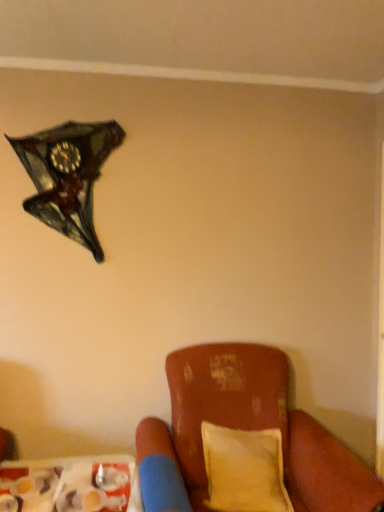
Question: In terms of height, does leather cushion at lower right look taller or shorter compared to yellow fabric pillow at lower right?

Choices:
 (A) tall
 (B) short

Answer: (A)

Question: Is leather cushion at lower right spatially inside yellow fabric pillow at lower right, or outside of it?

Choices:
 (A) inside
 (B) outside

Answer: (B)

Question: Considering the real-world distances, which object is closest to the yellow fabric pillow at lower right?

Choices:
 (A) shiny glass clock at upper left
 (B) plastic tray at lower left
 (C) leather cushion at lower right

Answer: (C)

Question: Estimate the real-world distances between objects in this image. Which object is closer to the plastic tray at lower left?

Choices:
 (A) leather cushion at lower right
 (B) yellow fabric pillow at lower right
 (C) shiny glass clock at upper left

Answer: (A)